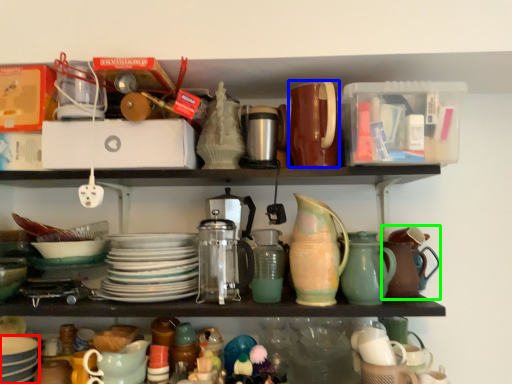
Question: Which is nearer to the tableware (highlighted by a red box)? tableware (highlighted by a blue box) or tea pot (highlighted by a green box).

Choices:
 (A) tableware
 (B) tea pot

Answer: (A)